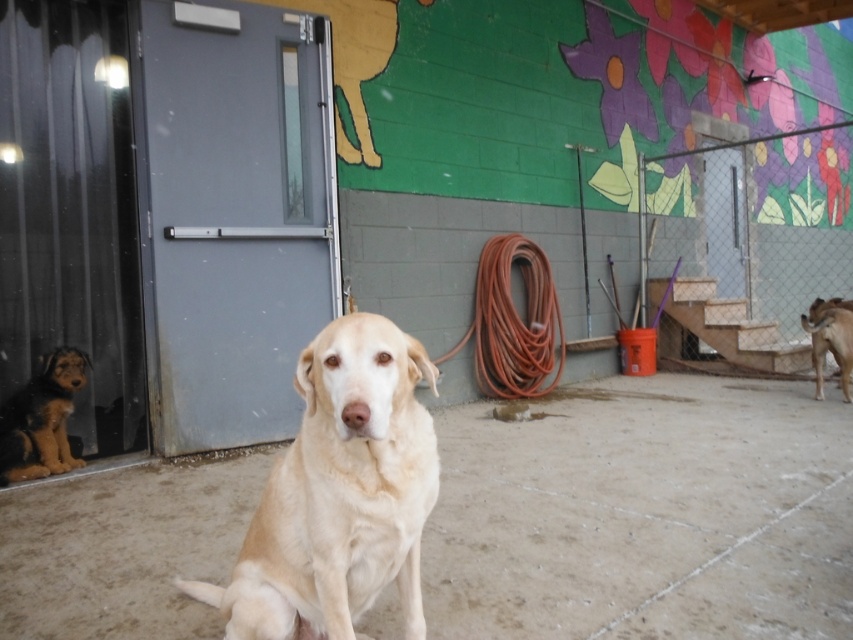
The height and width of the screenshot is (640, 853). Describe the element at coordinates (339, 493) in the screenshot. I see `light beige fur at center` at that location.

The image size is (853, 640). Identify the location of light beige fur at center. (339, 493).

You are a GUI agent. You are given a task and a screenshot of the screen. Output one action in this format:
    pyautogui.click(x=<x>, y=<y>)
    Task: Click on the light beige fur at center
    The height and width of the screenshot is (640, 853).
    Given the screenshot: What is the action you would take?
    pyautogui.click(x=339, y=493)

Between point (405, 502) and point (67, 461), which one is positioned in front?

Positioned in front is point (405, 502).

Between point (418, 499) and point (3, 442), which one is positioned behind?

The point (3, 442) is more distant.

Does point (405, 513) come farther from viewer compared to point (54, 388)?

No.

Image resolution: width=853 pixels, height=640 pixels. Find the location of `light beige fur at center`. light beige fur at center is located at coordinates (339, 493).

Can you confirm if light beige fur at center is shorter than rubber hose at center?

Correct, light beige fur at center is not as tall as rubber hose at center.

Image resolution: width=853 pixels, height=640 pixels. What do you see at coordinates (339, 493) in the screenshot?
I see `light beige fur at center` at bounding box center [339, 493].

Describe the element at coordinates (339, 493) in the screenshot. I see `light beige fur at center` at that location.

In order to click on light beige fur at center in this screenshot , I will do `click(339, 493)`.